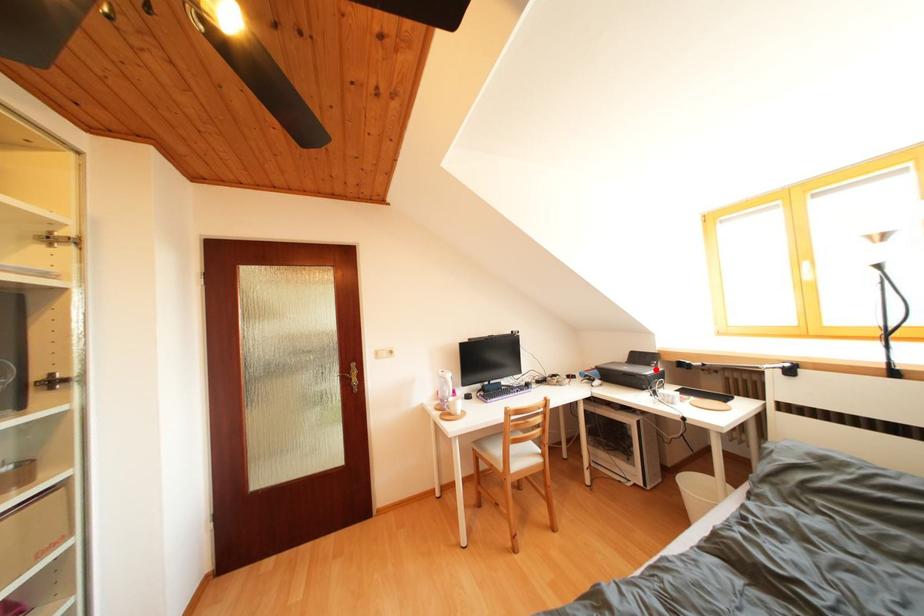
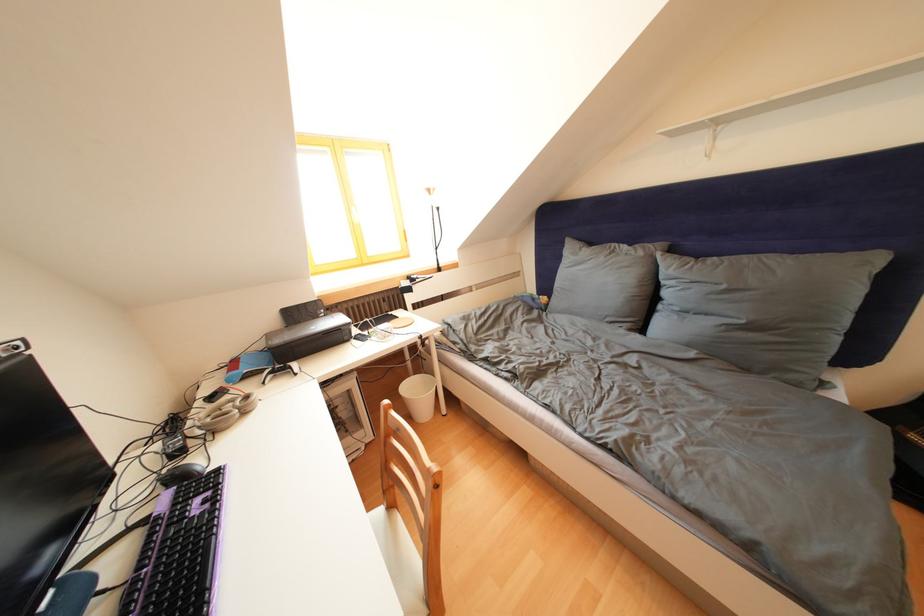
Where in the second image is the point corresponding to the highlighted location from the first image?

(323, 322)